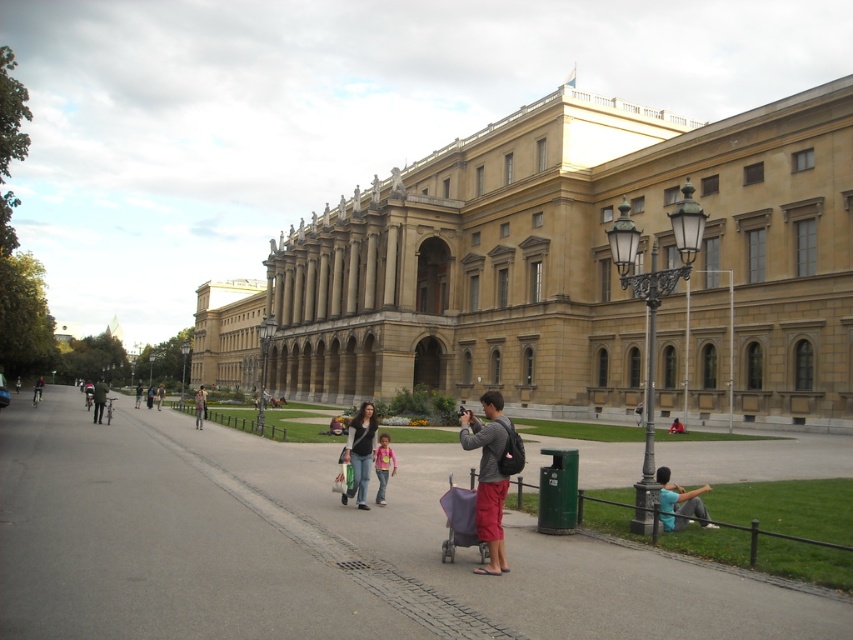
Question: Observing the image, what is the correct spatial positioning of dark gray jacket at left in reference to denim jacket at center?

Choices:
 (A) right
 (B) left

Answer: (B)

Question: Can you confirm if golden stone palace at center is smaller than blue denim jeans at lower right?

Choices:
 (A) yes
 (B) no

Answer: (B)

Question: Which point is farther to the camera?

Choices:
 (A) (479, 541)
 (B) (399, 609)
 (C) (381, 449)

Answer: (C)

Question: Which point is farther to the camera?

Choices:
 (A) (704, 522)
 (B) (350, 420)
 (C) (25, 545)

Answer: (B)

Question: Does denim jeans at center come behind dark gray jacket at left?

Choices:
 (A) yes
 (B) no

Answer: (B)

Question: Which point is closer to the camera?

Choices:
 (A) gray asphalt pavement at center
 (B) denim jacket at center

Answer: (A)